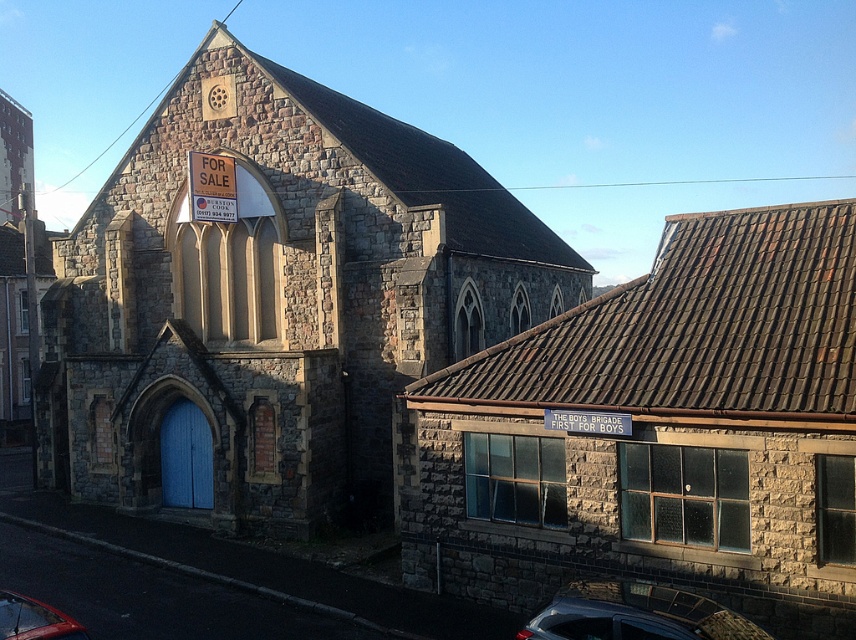
You are a delivery driver who needs to park your silver metallic car at lower right as close as possible to the stone textured chapel at center without blocking the entrance. Can you park the car directly in front of the chapel?

The stone textured chapel at center is positioned over the silver metallic car at lower right, meaning the car is already parked directly beneath the chapel. Since the chapel has a central arched doorway, parking directly in front would block the entrance. Therefore, you should park the car to the side instead of directly in front to avoid blocking the entrance.

You are a delivery driver who needs to park your silver metallic car at lower right near the stone textured chapel at center. The parking spot requires vehicles to be within 10 meters of the chapel. Can your car meet this requirement?

The stone textured chapel at center and silver metallic car at lower right are 12.90 meters apart from each other, so the car is 2.90 meters beyond the required 10 meters. Therefore, the car cannot meet the parking requirement.

You are a delivery person who needs to park your delivery van between the silver metallic car at lower right and the shiny red car at lower left. Can you fit your van, which is 1.8 meters wide, in the space between them?

The space between the silver metallic car at lower right and the shiny red car at lower left is not specified in the provided information. However, since the silver metallic car at lower right is larger than the shiny red car at lower left, the distance between them may vary. Without exact measurements, it is uncertain if the van can fit. Please check the actual space before attempting to park.